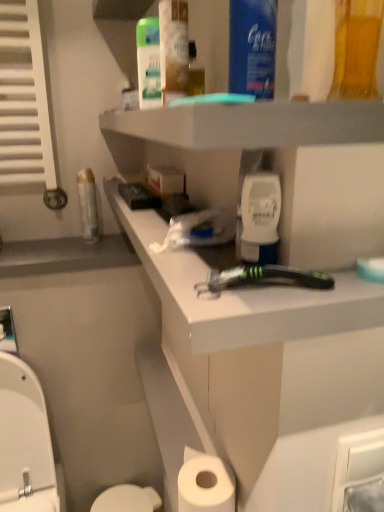
I want to click on free spot above white glossy toilet bowl at lower left (from a real-world perspective), so pyautogui.click(x=134, y=498).